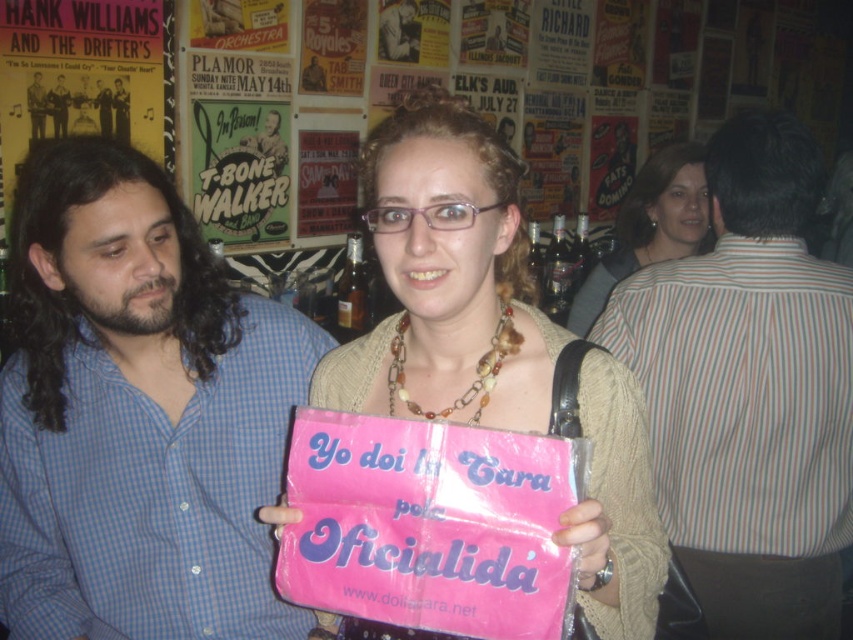
Is point (61, 90) farther from camera compared to point (117, 118)?

No, it is in front of (117, 118).

Is blue checkered shirt at left wider than smooth black shirt at upper left?

In fact, blue checkered shirt at left might be narrower than smooth black shirt at upper left.

Find the location of a particular element. The width and height of the screenshot is (853, 640). blue checkered shirt at left is located at coordinates (59, 106).

Consider the image. Can you confirm if blue checkered shirt at center is shorter than striped shirt at center?

Correct, blue checkered shirt at center is not as tall as striped shirt at center.

Who is taller, blue checkered shirt at center or striped shirt at center?

striped shirt at center is taller.

Is point (270, 344) positioned before point (743, 371)?

Yes.

The image size is (853, 640). Identify the location of blue checkered shirt at center. (137, 413).

The height and width of the screenshot is (640, 853). What do you see at coordinates (137, 413) in the screenshot? I see `blue checkered shirt at center` at bounding box center [137, 413].

How much distance is there between blue checkered shirt at center and pink plastic bag at center?

blue checkered shirt at center and pink plastic bag at center are 18.50 inches apart from each other.

Is point (36, 540) behind point (569, 609)?

Yes.

This screenshot has height=640, width=853. Find the location of `blue checkered shirt at center`. blue checkered shirt at center is located at coordinates (137, 413).